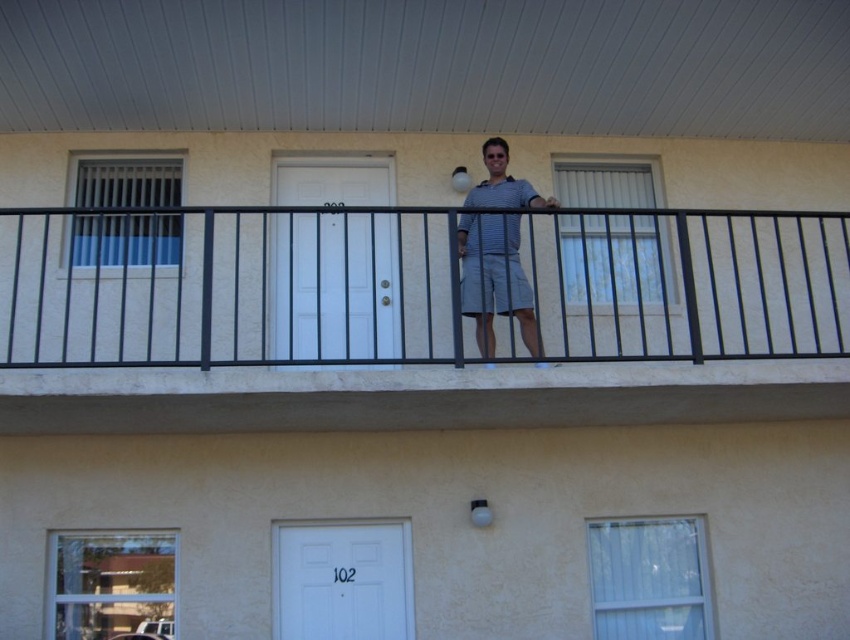
Is black metal railing at upper center smaller than striped fabric shorts at center?

No, black metal railing at upper center is not smaller than striped fabric shorts at center.

Consider the image. Who is positioned more to the left, black metal railing at upper center or striped fabric shorts at center?

Positioned to the left is black metal railing at upper center.

From the picture: Who is more distant from viewer, [224,228] or [476,324]?

The point [224,228] is more distant.

I want to click on black metal railing at upper center, so click(418, 321).

Is point (667, 237) farther from camera compared to point (508, 244)?

Yes, it is.

Does point (673, 369) come behind point (508, 220)?

No.

The image size is (850, 640). Find the location of `black metal railing at upper center`. black metal railing at upper center is located at coordinates (418, 321).

Find the location of a particular element. This screenshot has width=850, height=640. striped fabric shorts at center is located at coordinates (496, 280).

Who is more distant from viewer, [527,336] or [494,228]?

The point [494,228] is behind.

Which is in front, point (488, 330) or point (514, 184)?

Point (488, 330)

Image resolution: width=850 pixels, height=640 pixels. I want to click on striped fabric shorts at center, so click(x=496, y=280).